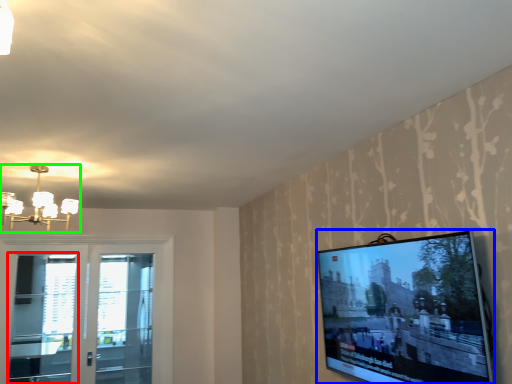
Question: Estimate the real-world distances between objects in this image. Which object is closer to screen door (highlighted by a red box), television (highlighted by a blue box) or light fixture (highlighted by a green box)?

Choices:
 (A) television
 (B) light fixture

Answer: (B)